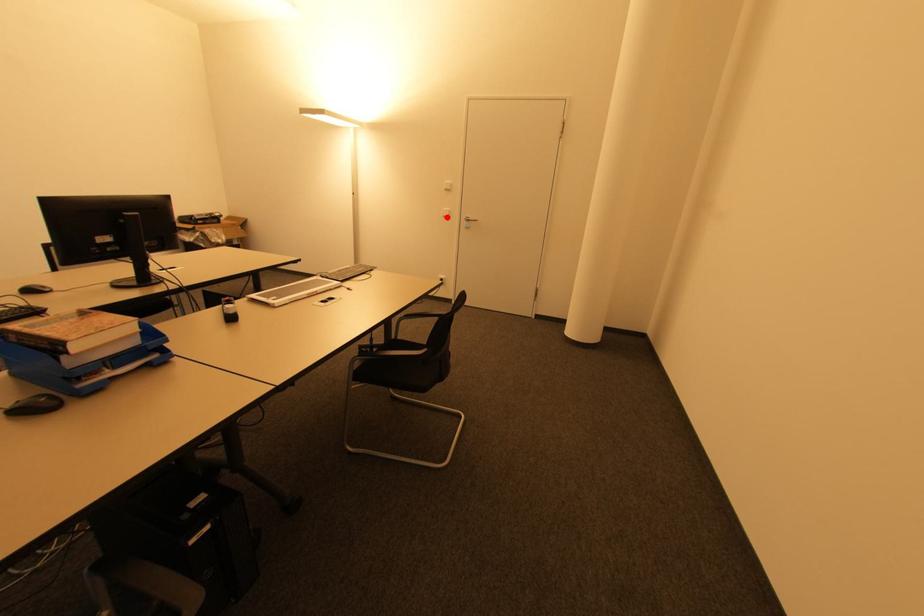
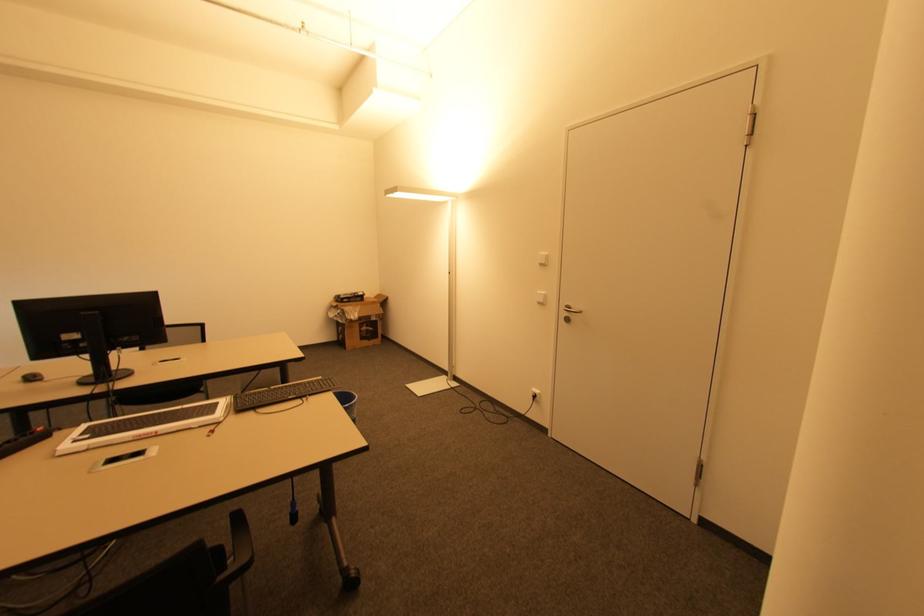
Find the pixel in the second image that matches the highlighted location in the first image.

(541, 302)